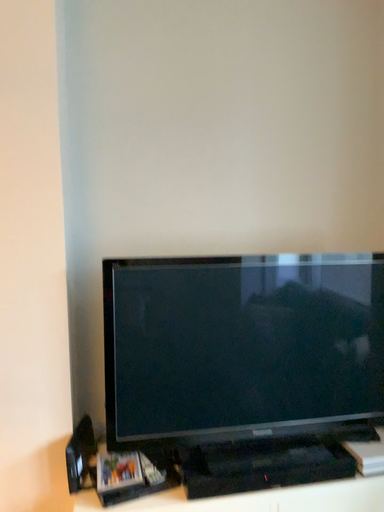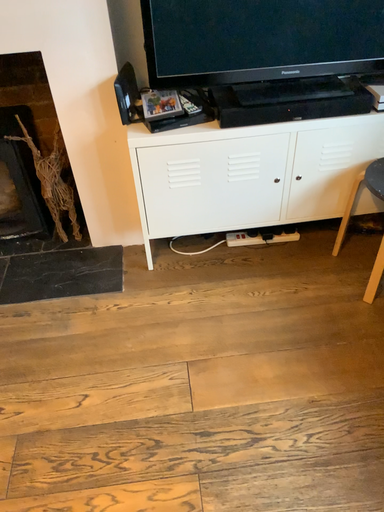
Question: Which way did the camera rotate in the video?

Choices:
 (A) rotated downward
 (B) rotated upward

Answer: (A)